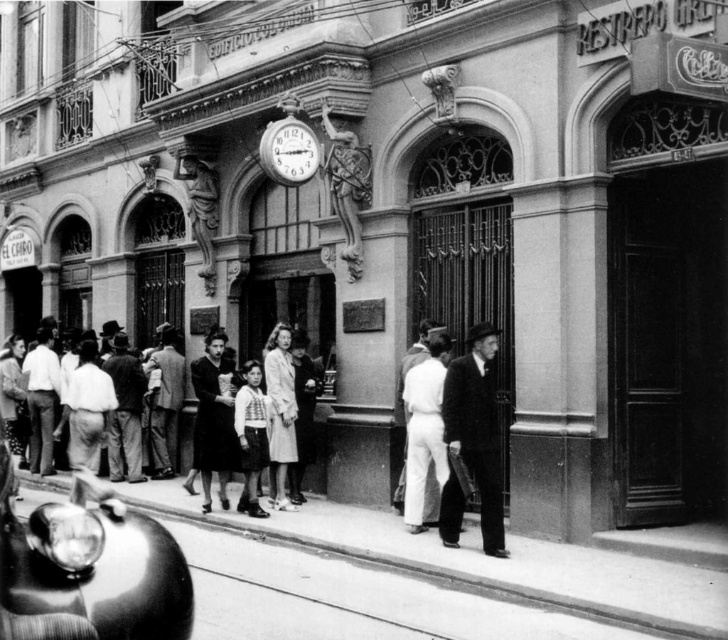
Question: Considering the real-world distances, which object is closest to the matte black dress at center?

Choices:
 (A) metallic clock at center
 (B) dark suit at right

Answer: (A)

Question: Estimate the real-world distances between objects in this image. Which object is closer to the dark fabric dress at center?

Choices:
 (A) metallic clock at center
 (B) matte black dress at center

Answer: (B)

Question: From the image, what is the correct spatial relationship of dark suit at right in relation to metallic clock at center?

Choices:
 (A) below
 (B) above

Answer: (A)

Question: Which object is closer to the camera taking this photo?

Choices:
 (A) light gray fabric coat at center
 (B) smooth concrete curb at lower left
 (C) metallic clock at center

Answer: (C)

Question: Can you confirm if dark suit at right is wider than matte black dress at center?

Choices:
 (A) yes
 (B) no

Answer: (B)

Question: Is smooth concrete curb at lower left further to camera compared to light brown fabric shirt at center?

Choices:
 (A) yes
 (B) no

Answer: (A)